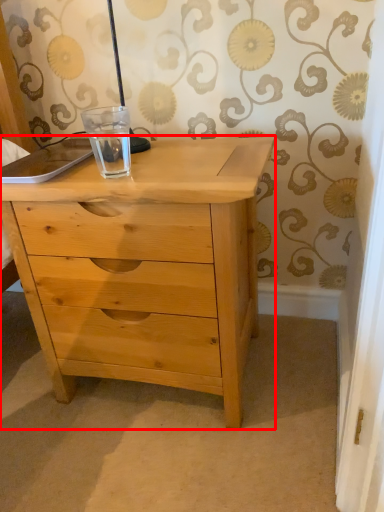
Question: From the image's perspective, where is chest of drawers (annotated by the red box) located in relation to glass jar in the image?

Choices:
 (A) above
 (B) below

Answer: (B)